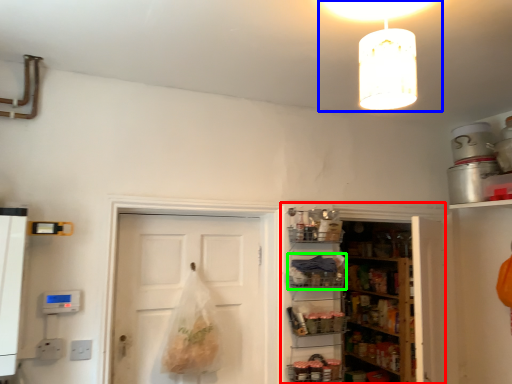
Question: Which object is the closest to the cabinetry (highlighted by a red box)? Choose among these: light fixture (highlighted by a blue box) or shelf (highlighted by a green box).

Choices:
 (A) light fixture
 (B) shelf

Answer: (B)